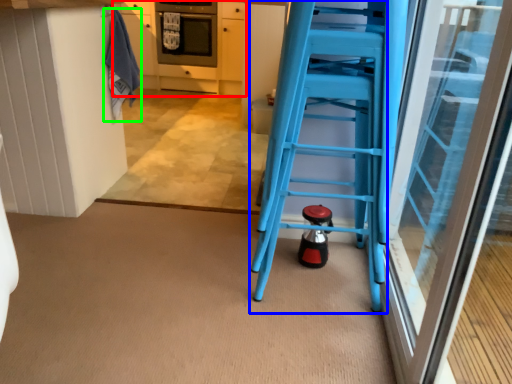
Question: Estimate the real-world distances between objects in this image. Which object is farther from cabinetry (highlighted by a red box), ladder (highlighted by a blue box) or laundry (highlighted by a green box)?

Choices:
 (A) ladder
 (B) laundry

Answer: (A)